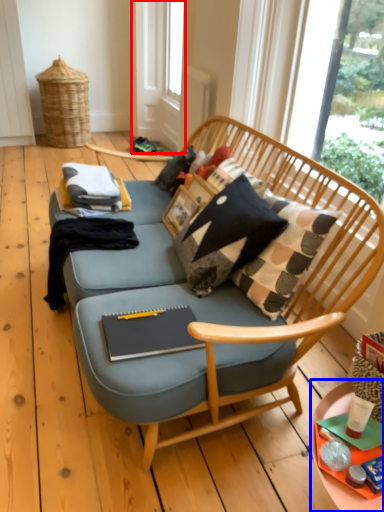
Question: Among these objects, which one is nearest to the camera, screen door (highlighted by a red box) or desk (highlighted by a blue box)?

Choices:
 (A) screen door
 (B) desk

Answer: (B)